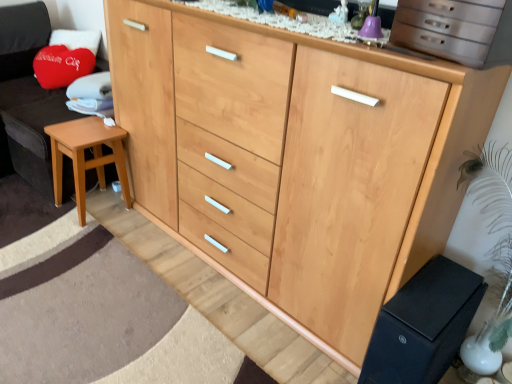
Question: From the image's perspective, does light brown wood stool at lower left appear lower than black matte changing table at lower right?

Choices:
 (A) no
 (B) yes

Answer: (A)

Question: Is black matte changing table at lower right inside light brown wood stool at lower left?

Choices:
 (A) yes
 (B) no

Answer: (B)

Question: Considering the relative positions of light brown wood stool at lower left and black matte changing table at lower right in the image provided, is light brown wood stool at lower left behind black matte changing table at lower right?

Choices:
 (A) yes
 (B) no

Answer: (A)

Question: Can you confirm if light brown wood stool at lower left is positioned to the right of black matte changing table at lower right?

Choices:
 (A) no
 (B) yes

Answer: (A)

Question: From a real-world perspective, is light brown wood stool at lower left on top of black matte changing table at lower right?

Choices:
 (A) no
 (B) yes

Answer: (B)

Question: Considering the positions of wooden stool at left and metallic silver drawers at upper right in the image, is wooden stool at left taller or shorter than metallic silver drawers at upper right?

Choices:
 (A) short
 (B) tall

Answer: (B)

Question: In terms of size, does wooden stool at left appear bigger or smaller than metallic silver drawers at upper right?

Choices:
 (A) big
 (B) small

Answer: (A)

Question: From the image's perspective, is wooden stool at left above or below metallic silver drawers at upper right?

Choices:
 (A) above
 (B) below

Answer: (A)

Question: Considering their positions, is wooden stool at left located in front of or behind metallic silver drawers at upper right?

Choices:
 (A) front
 (B) behind

Answer: (B)

Question: Is light brown wood stool at lower left to the left or to the right of black matte changing table at lower right in the image?

Choices:
 (A) left
 (B) right

Answer: (A)

Question: Considering the positions of light brown wood stool at lower left and black matte changing table at lower right in the image, is light brown wood stool at lower left bigger or smaller than black matte changing table at lower right?

Choices:
 (A) big
 (B) small

Answer: (A)

Question: In terms of height, does light brown wood stool at lower left look taller or shorter compared to black matte changing table at lower right?

Choices:
 (A) short
 (B) tall

Answer: (B)

Question: From the image's perspective, is light brown wood stool at lower left positioned above or below black matte changing table at lower right?

Choices:
 (A) below
 (B) above

Answer: (B)

Question: Choose the correct answer: Is black matte changing table at lower right inside metallic silver drawers at upper right or outside it?

Choices:
 (A) inside
 (B) outside

Answer: (B)

Question: From the image's perspective, is black matte changing table at lower right positioned above or below metallic silver drawers at upper right?

Choices:
 (A) above
 (B) below

Answer: (B)